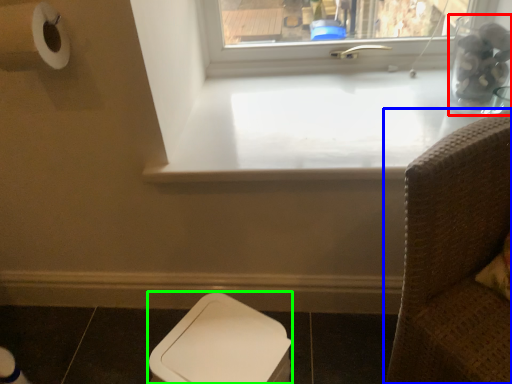
Question: Estimate the real-world distances between objects in this image. Which object is closer to glass vase (highlighted by a red box), furniture (highlighted by a blue box) or toilet bowl (highlighted by a green box)?

Choices:
 (A) furniture
 (B) toilet bowl

Answer: (A)